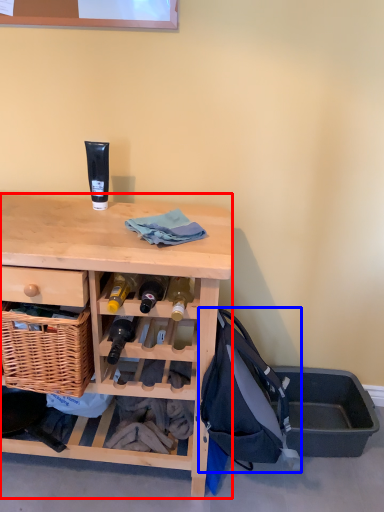
Question: Which object appears farthest to the camera in this image, desk (highlighted by a red box) or backpack (highlighted by a blue box)?

Choices:
 (A) desk
 (B) backpack

Answer: (B)